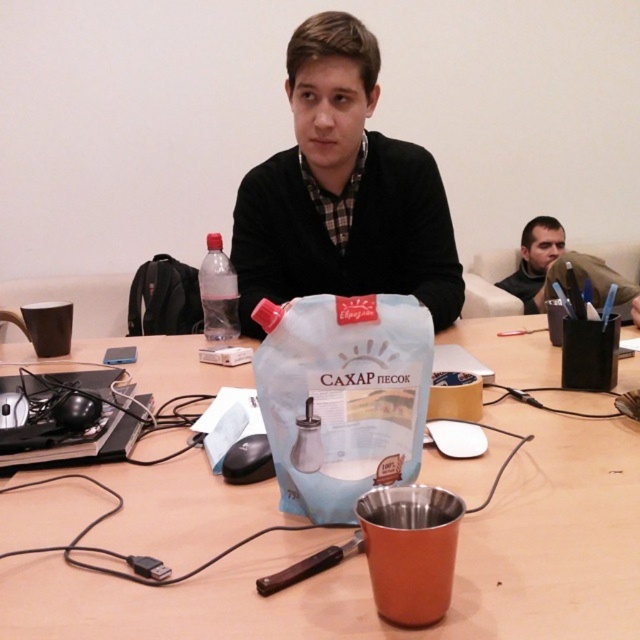
Is black matte sweater at center bigger than matte black jacket at upper right?

Indeed, black matte sweater at center has a larger size compared to matte black jacket at upper right.

Which is in front, point (308, 77) or point (534, 276)?

Point (308, 77) is more forward.

Is point (349, 44) less distant than point (541, 259)?

Yes, it is in front of point (541, 259).

This screenshot has height=640, width=640. What are the coordinates of `black matte sweater at center` in the screenshot? It's located at (342, 192).

Can you confirm if metallic silver table at center is bigger than transparent plastic bottle at center?

Yes.

Can you confirm if metallic silver table at center is positioned to the left of transparent plastic bottle at center?

No, metallic silver table at center is not to the left of transparent plastic bottle at center.

You are a GUI agent. You are given a task and a screenshot of the screen. Output one action in this format:
    pyautogui.click(x=<x>, y=<y>)
    Task: Click on the metallic silver table at center
    
    Given the screenshot: What is the action you would take?
    pyautogui.click(x=365, y=570)

Can you confirm if black matte sweater at center is positioned below white matte paper bag at center?

No, black matte sweater at center is not below white matte paper bag at center.

Who is lower down, black matte sweater at center or white matte paper bag at center?

Positioned lower is white matte paper bag at center.

Between point (413, 224) and point (330, 317), which one is positioned behind?

The point (413, 224) is behind.

This screenshot has width=640, height=640. What are the coordinates of `black matte sweater at center` in the screenshot? It's located at point(342,192).